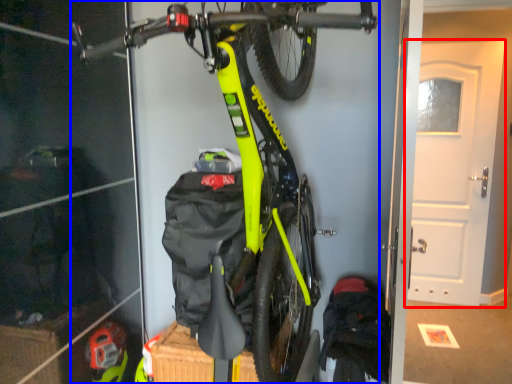
Question: Which object appears farthest to the camera in this image, door (highlighted by a red box) or bicycle (highlighted by a blue box)?

Choices:
 (A) door
 (B) bicycle

Answer: (A)